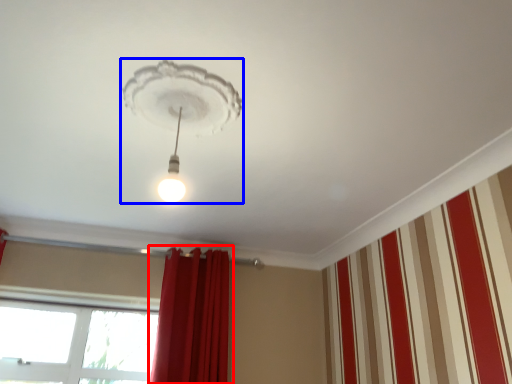
Question: Which of the following is the closest to the observer, curtain (highlighted by a red box) or lamp (highlighted by a blue box)?

Choices:
 (A) curtain
 (B) lamp

Answer: (B)